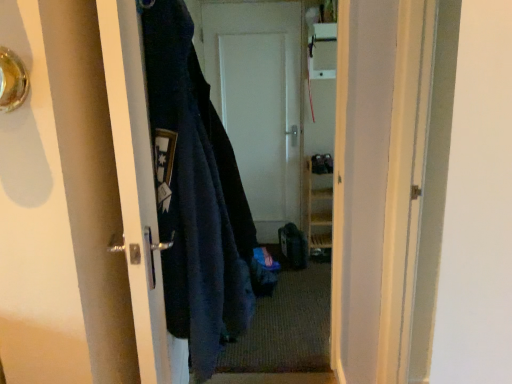
Question: Looking at their shapes, would you say dark blue fuzzy jacket at left is wider or thinner than white matte door at center, the first door in the right-to-left sequence?

Choices:
 (A) thin
 (B) wide

Answer: (B)

Question: From a real-world perspective, is dark blue fuzzy jacket at left positioned above or below white matte door at center, the first door viewed from the back?

Choices:
 (A) below
 (B) above

Answer: (B)

Question: Considering the real-world distances, which object is farthest from the metallic silver door handle at upper left?

Choices:
 (A) carpeted mat at center
 (B) white matte door at center, the first door in the right-to-left sequence
 (C) dark blue fuzzy jacket at left
 (D) matte black door handle at left, which is counted as the second door, starting from the back

Answer: (B)

Question: Which object is positioned farthest from the white matte door at center, the first door viewed from the back?

Choices:
 (A) dark blue fuzzy jacket at left
 (B) matte black door handle at left, the 2th door viewed from the right
 (C) metallic silver door handle at upper left
 (D) carpeted mat at center

Answer: (C)